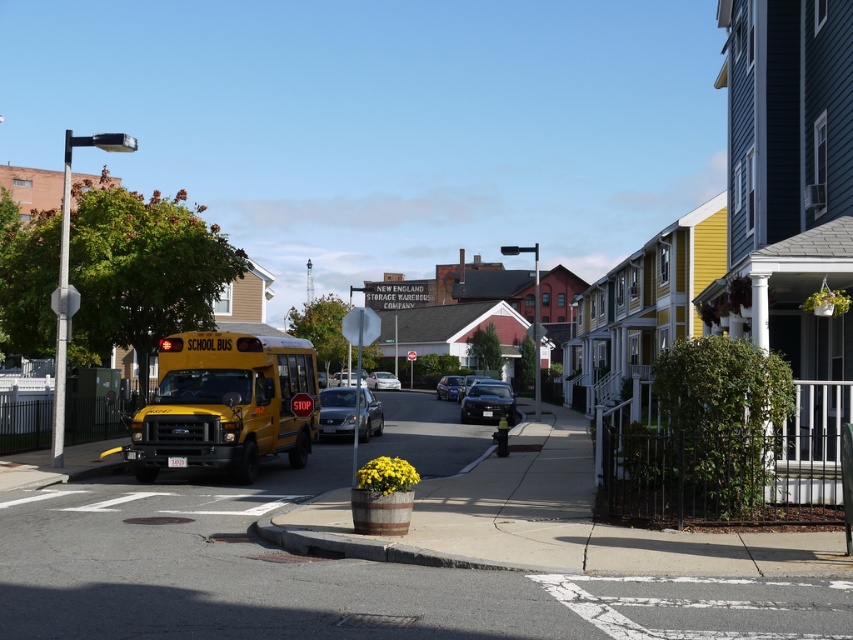
Can you confirm if glossy black car at center is wider than shiny black sedan at center?

Yes.

Does glossy black car at center have a lesser height compared to shiny black sedan at center?

Indeed, glossy black car at center has a lesser height compared to shiny black sedan at center.

Does point (480, 392) come behind point (456, 378)?

No, it is in front of (456, 378).

The image size is (853, 640). What are the coordinates of `glossy black car at center` in the screenshot? It's located at (488, 403).

Can you confirm if satin silver sedan at center is positioned above metallic silver sedan at center?

Incorrect, satin silver sedan at center is not positioned above metallic silver sedan at center.

The width and height of the screenshot is (853, 640). What do you see at coordinates (335, 412) in the screenshot?
I see `satin silver sedan at center` at bounding box center [335, 412].

At what (x,y) coordinates should I click in order to perform the action: click on satin silver sedan at center. Please return your answer as a coordinate pair (x, y). Looking at the image, I should click on (335, 412).

Is yellow matte/solid school bus at lower left thinner than glossy black car at center?

Incorrect, yellow matte/solid school bus at lower left's width is not less than glossy black car at center's.

Can you confirm if yellow matte/solid school bus at lower left is bigger than glossy black car at center?

Indeed, yellow matte/solid school bus at lower left has a larger size compared to glossy black car at center.

Who is more distant from viewer, (132, 422) or (494, 401)?

Positioned behind is point (494, 401).

Where is `yellow matte/solid school bus at lower left`? The image size is (853, 640). yellow matte/solid school bus at lower left is located at coordinates (225, 404).